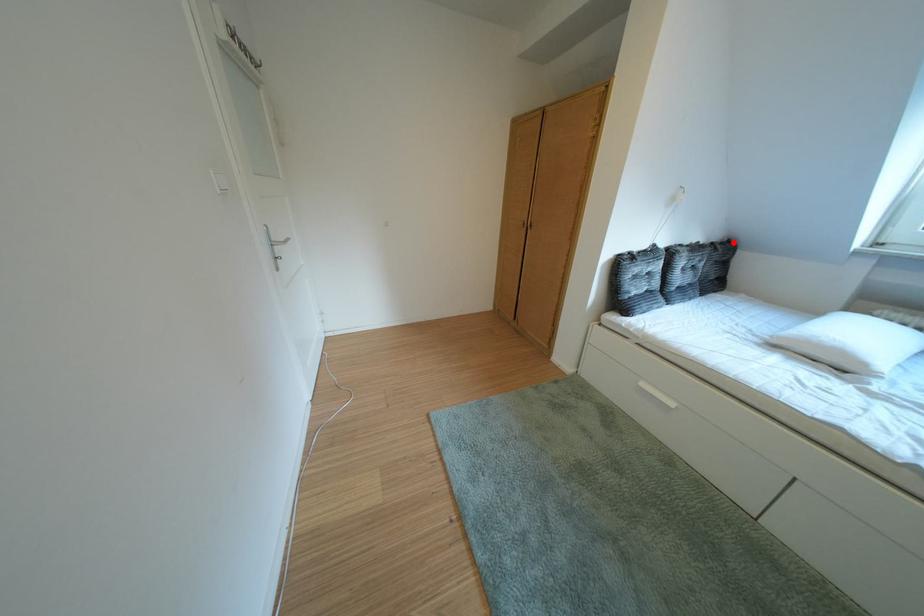
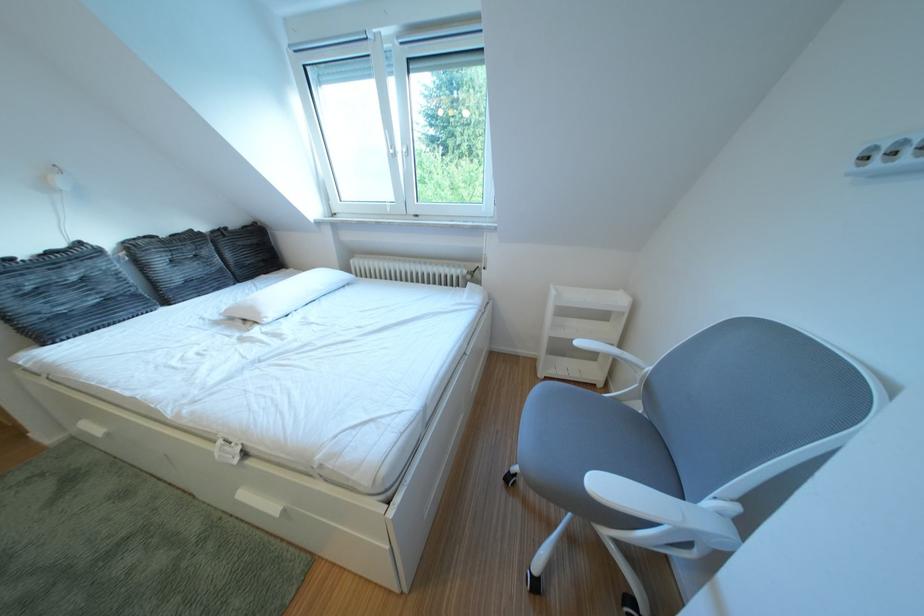
Find the pixel in the second image that matches the highlighted location in the first image.

(247, 228)